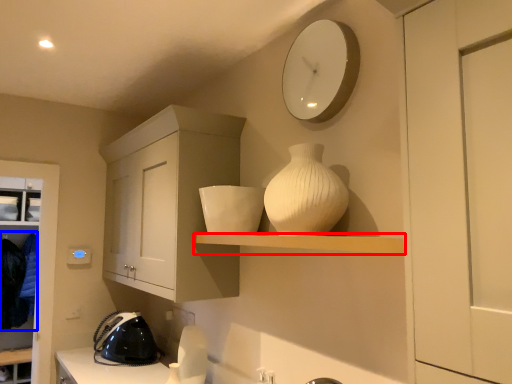
Question: Which point is further to the camera, shelf (highlighted by a red box) or laundry (highlighted by a blue box)?

Choices:
 (A) shelf
 (B) laundry

Answer: (B)